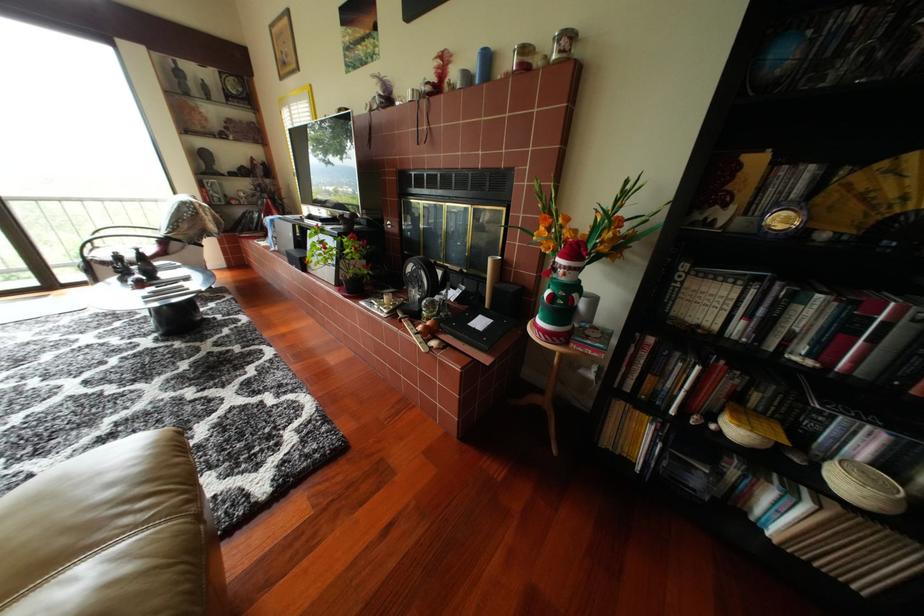
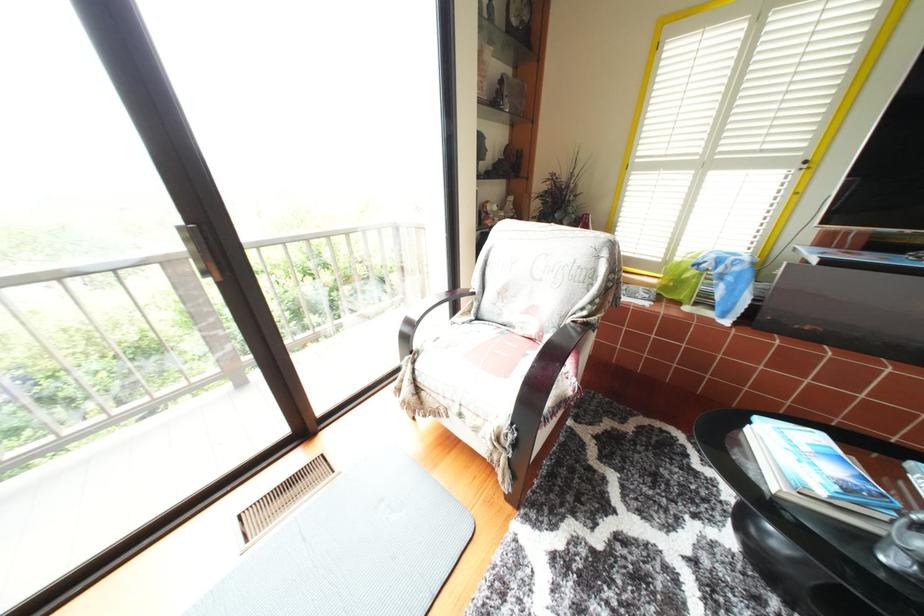
In a continuous first-person perspective shot, in which direction is the camera moving?

The cameraman moved toward left, forward.